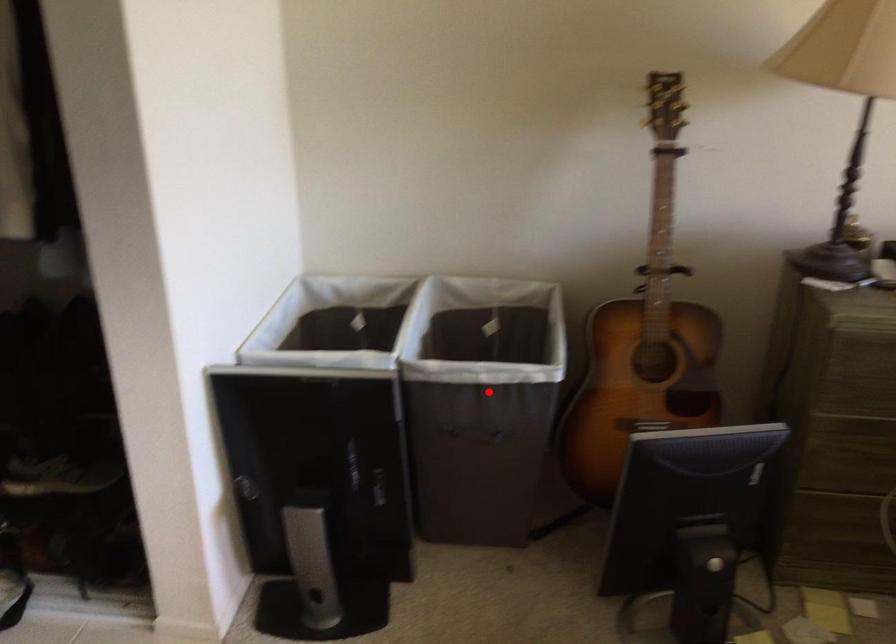
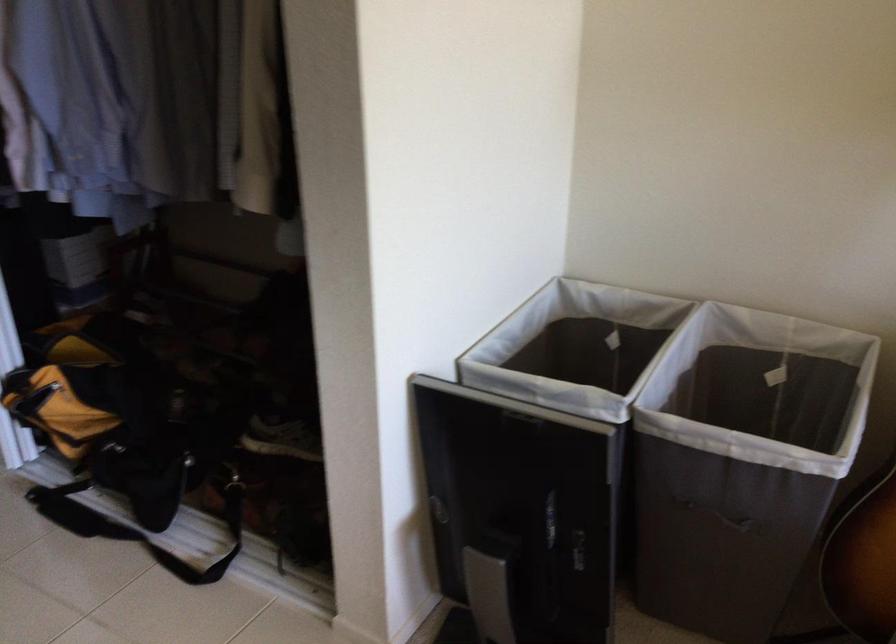
In the second image, find the point that corresponds to the highlighted location in the first image.

(742, 462)